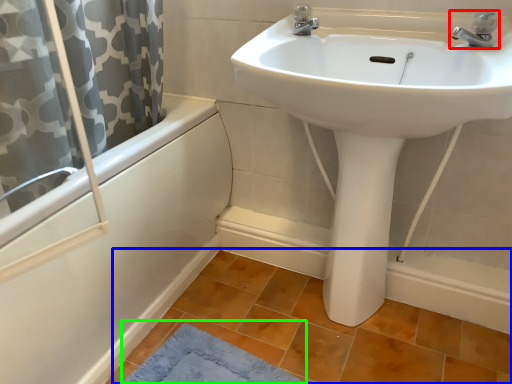
Question: Which object is the closest to the tap (highlighted by a red box)? Choose among these: tile (highlighted by a blue box) or bath mat (highlighted by a green box).

Choices:
 (A) tile
 (B) bath mat

Answer: (A)